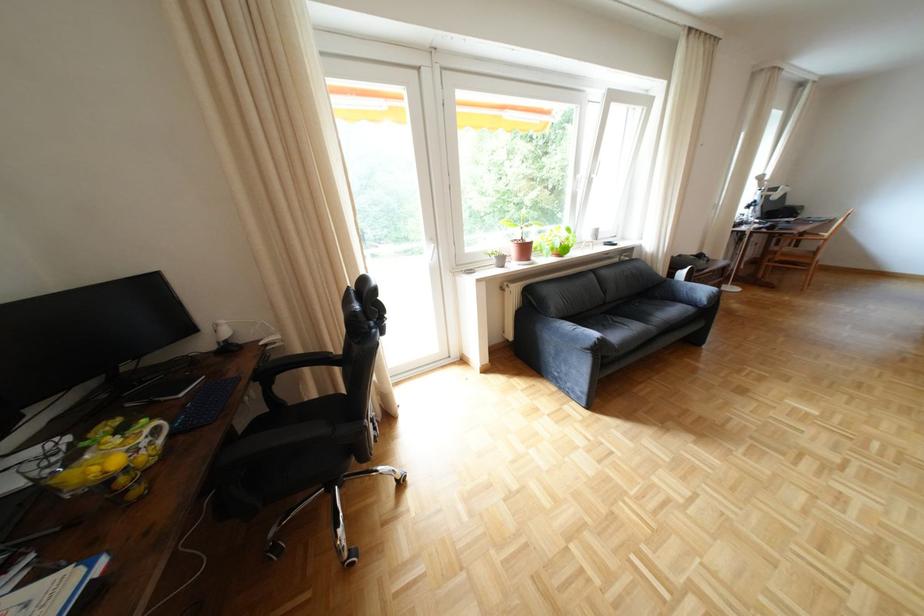
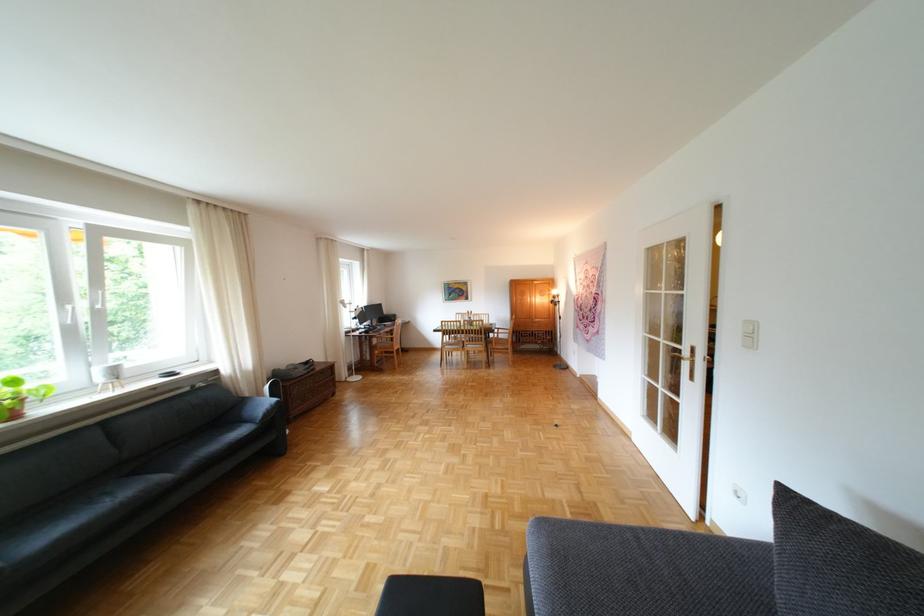
Locate, in the second image, the point that corresponds to pixel 703 302 in the first image.

(263, 421)